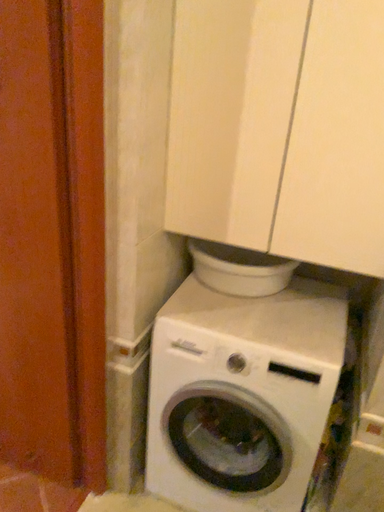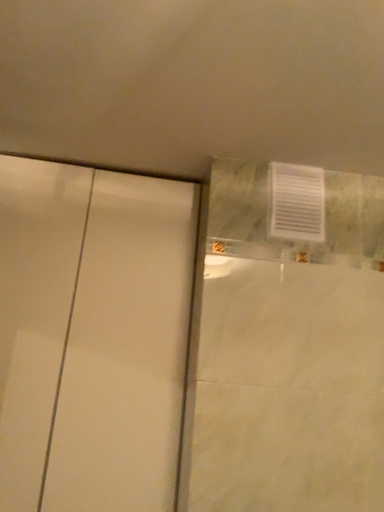
Question: How did the camera likely rotate when shooting the video?

Choices:
 (A) rotated downward
 (B) rotated upward

Answer: (B)